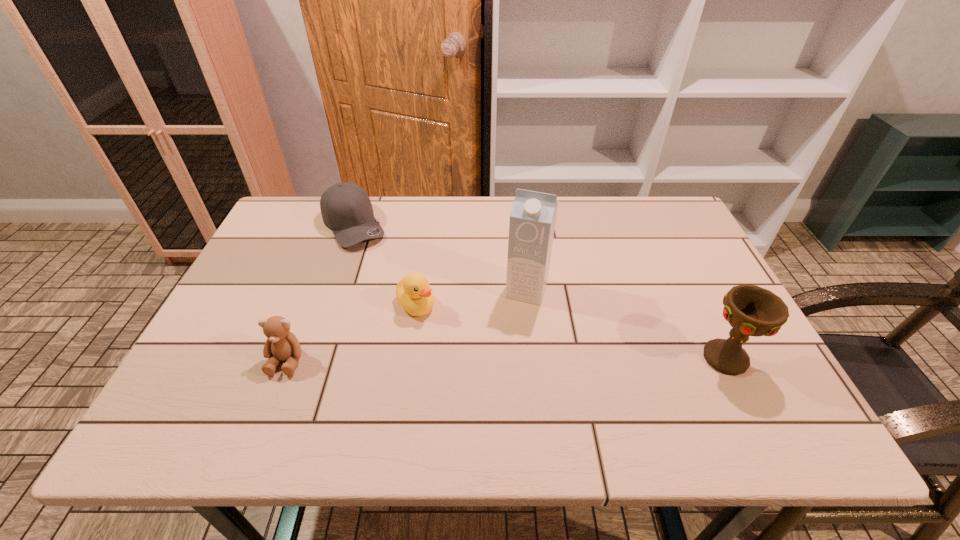
Locate an element on the screen. This screenshot has width=960, height=540. vacant region located 0.090m on the front label of the second object from right to left is located at coordinates (513, 331).

At what (x,y) coordinates should I click in order to perform the action: click on vacant space located on the front brim of the farthest object. Please return your answer as a coordinate pair (x, y). Looking at the image, I should click on (385, 278).

You are a GUI agent. You are given a task and a screenshot of the screen. Output one action in this format:
    pyautogui.click(x=<x>, y=<y>)
    Task: Click on the free spot located on the front brim of the farthest object
    The image size is (960, 540).
    Given the screenshot: What is the action you would take?
    pyautogui.click(x=387, y=280)

Find the location of a particular element. vacant space located on the front brim of the farthest object is located at coordinates (393, 288).

You are a GUI agent. You are given a task and a screenshot of the screen. Output one action in this format:
    pyautogui.click(x=<x>, y=<y>)
    Task: Click on the vacant space located on the face of the duckling
    
    Given the screenshot: What is the action you would take?
    pyautogui.click(x=459, y=357)

The width and height of the screenshot is (960, 540). Identify the location of vacant space located on the face of the duckling. (479, 382).

Locate an element on the screen. This screenshot has width=960, height=540. free region located on the face of the duckling is located at coordinates (441, 335).

At what (x,y) coordinates should I click in order to perform the action: click on object situated at the far edge. Please return your answer as a coordinate pair (x, y). Looking at the image, I should click on (346, 209).

I want to click on teddy bear that is at the near edge, so click(x=281, y=344).

I want to click on chalice situated at the near edge, so click(x=751, y=310).